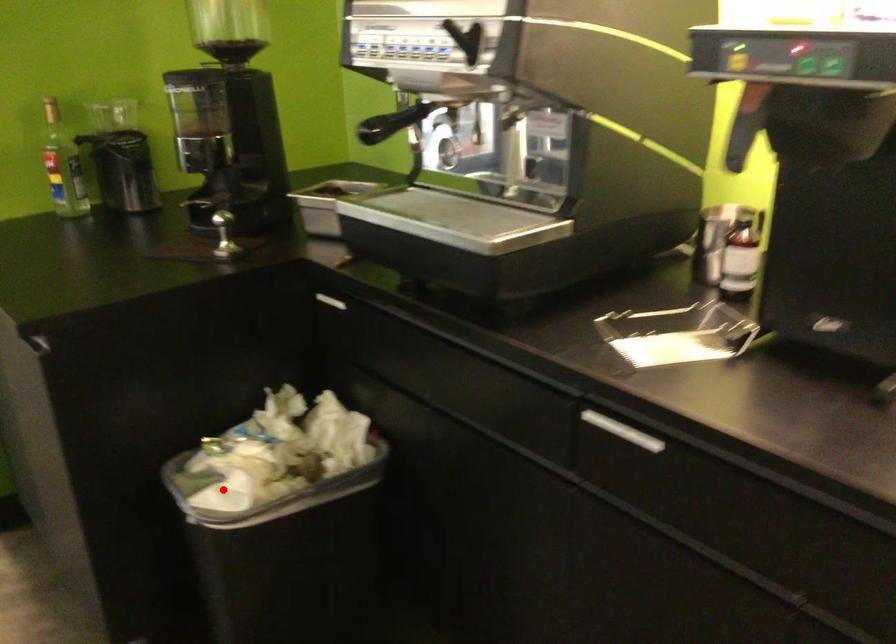
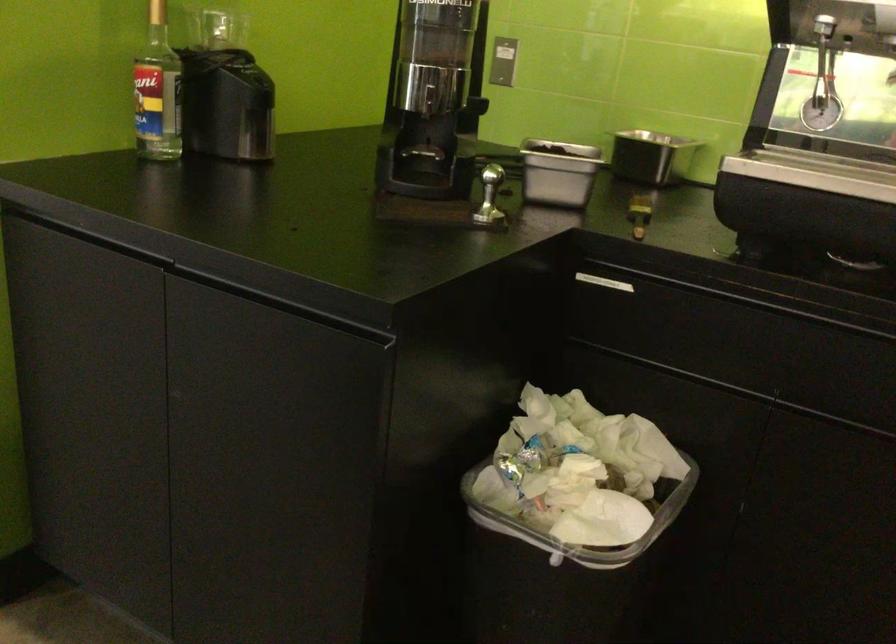
Find the pixel in the second image that matches the highlighted location in the first image.

(581, 524)